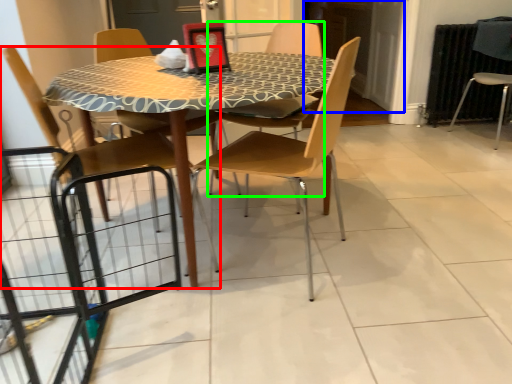
Question: Which object is the closest to the chair (highlighted by a red box)? Choose among these: screen door (highlighted by a blue box) or chair (highlighted by a green box).

Choices:
 (A) screen door
 (B) chair

Answer: (B)